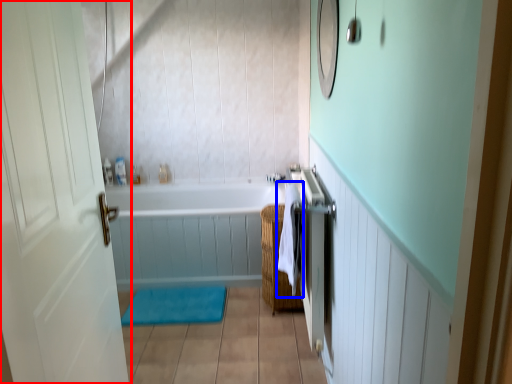
Question: Which object is further to the camera taking this photo, door (highlighted by a red box) or beach towel (highlighted by a blue box)?

Choices:
 (A) door
 (B) beach towel

Answer: (B)